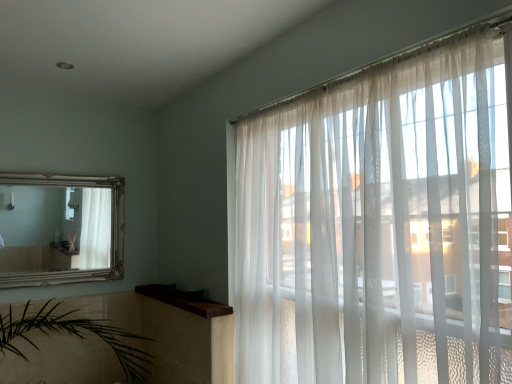
The width and height of the screenshot is (512, 384). Describe the element at coordinates (378, 229) in the screenshot. I see `translucent white curtains at right` at that location.

The width and height of the screenshot is (512, 384). What are the coordinates of `silver/gilded mirror at upper left` in the screenshot? It's located at click(54, 229).

From a real-world perspective, which object rests below the other?

brown wood at upper left is physically lower.

Would you say brown wood at upper left is a long distance from silver/gilded mirror at upper left?

Actually, brown wood at upper left and silver/gilded mirror at upper left are a little close together.

From the image's perspective, is brown wood at upper left below silver/gilded mirror at upper left?

Indeed, from the image's perspective, brown wood at upper left is shown beneath silver/gilded mirror at upper left.

From the picture: From a real-world perspective, relative to brown wood at upper left, is silver/gilded mirror at upper left vertically above or below?

silver/gilded mirror at upper left is above brown wood at upper left.

Can you confirm if silver/gilded mirror at upper left is wider than brown wood at upper left?

Incorrect, the width of silver/gilded mirror at upper left does not surpass that of brown wood at upper left.

Measure the distance between silver/gilded mirror at upper left and translucent white curtains at right.

silver/gilded mirror at upper left and translucent white curtains at right are 5.85 feet apart from each other.

Between silver/gilded mirror at upper left and translucent white curtains at right, which one has less height?

With less height is silver/gilded mirror at upper left.

Is translucent white curtains at right surrounded by silver/gilded mirror at upper left?

Definitely not — translucent white curtains at right is not inside silver/gilded mirror at upper left.

Is silver/gilded mirror at upper left at the left side of translucent white curtains at right?

Yes, silver/gilded mirror at upper left is to the left of translucent white curtains at right.

There is a translucent white curtains at right. Where is `mirror above it (from a real-world perspective)`? The width and height of the screenshot is (512, 384). mirror above it (from a real-world perspective) is located at coordinates (54, 229).

Is translucent white curtains at right looking in the opposite direction of silver/gilded mirror at upper left?

translucent white curtains at right is not turned away from silver/gilded mirror at upper left.

Between point (277, 285) and point (18, 259), which one is positioned in front?

The point (277, 285) is closer to the camera.

Considering the sizes of objects translucent white curtains at right and silver/gilded mirror at upper left in the image provided, who is shorter, translucent white curtains at right or silver/gilded mirror at upper left?

silver/gilded mirror at upper left is shorter.

Is translucent white curtains at right not close to brown wood at upper left?

No, translucent white curtains at right is in close proximity to brown wood at upper left.

Where is `window located on the right of brown wood at upper left`? This screenshot has height=384, width=512. window located on the right of brown wood at upper left is located at coordinates (378, 229).

From the image's perspective, is translucent white curtains at right beneath brown wood at upper left?

No, from the image's perspective, translucent white curtains at right is not beneath brown wood at upper left.

Could you tell me if translucent white curtains at right is turned towards brown wood at upper left?

No, translucent white curtains at right is not aimed at brown wood at upper left.

Looking at this image, does brown wood at upper left contain translucent white curtains at right?

No, translucent white curtains at right is not inside brown wood at upper left.

Does brown wood at upper left have a lesser height compared to translucent white curtains at right?

Correct, brown wood at upper left is not as tall as translucent white curtains at right.

Is brown wood at upper left beside translucent white curtains at right?

No, brown wood at upper left is not with translucent white curtains at right.

Find the location of a particular element. mirror above the brown wood at upper left (from the image's perspective) is located at coordinates (54, 229).

In the image, there is a silver/gilded mirror at upper left. At what (x,y) coordinates should I click in order to perform the action: click on window sill below it (from the image's perspective). Please return your answer as a coordinate pair (x, y). Looking at the image, I should click on (185, 300).

Looking at the image, which one is located further to brown wood at upper left, silver/gilded mirror at upper left or translucent white curtains at right?

Among the two, translucent white curtains at right is located further to brown wood at upper left.

Estimate the real-world distances between objects in this image. Which object is further from silver/gilded mirror at upper left, brown wood at upper left or translucent white curtains at right?

translucent white curtains at right is positioned further to the anchor silver/gilded mirror at upper left.

Which object lies nearer to the anchor point translucent white curtains at right, brown wood at upper left or silver/gilded mirror at upper left?

Based on the image, brown wood at upper left appears to be nearer to translucent white curtains at right.

Estimate the real-world distances between objects in this image. Which object is closer to translucent white curtains at right, silver/gilded mirror at upper left or brown wood at upper left?

brown wood at upper left is closer to translucent white curtains at right.

Considering their positions, is translucent white curtains at right positioned further to brown wood at upper left than silver/gilded mirror at upper left?

Among the two, translucent white curtains at right is located further to brown wood at upper left.

From the picture: Estimate the real-world distances between objects in this image. Which object is further from silver/gilded mirror at upper left, translucent white curtains at right or brown wood at upper left?

translucent white curtains at right is further to silver/gilded mirror at upper left.

Identify the location of window sill positioned between translucent white curtains at right and silver/gilded mirror at upper left from near to far. (185, 300).